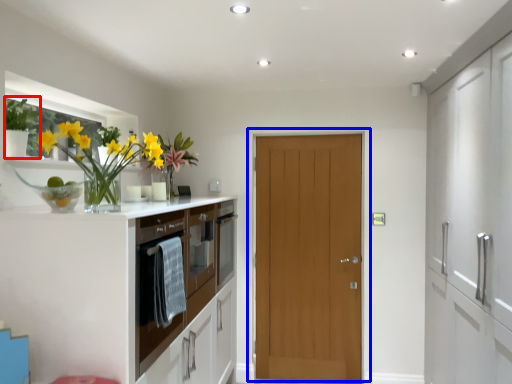
Question: Which point is further to the camera, plant (highlighted by a red box) or door (highlighted by a blue box)?

Choices:
 (A) plant
 (B) door

Answer: (B)